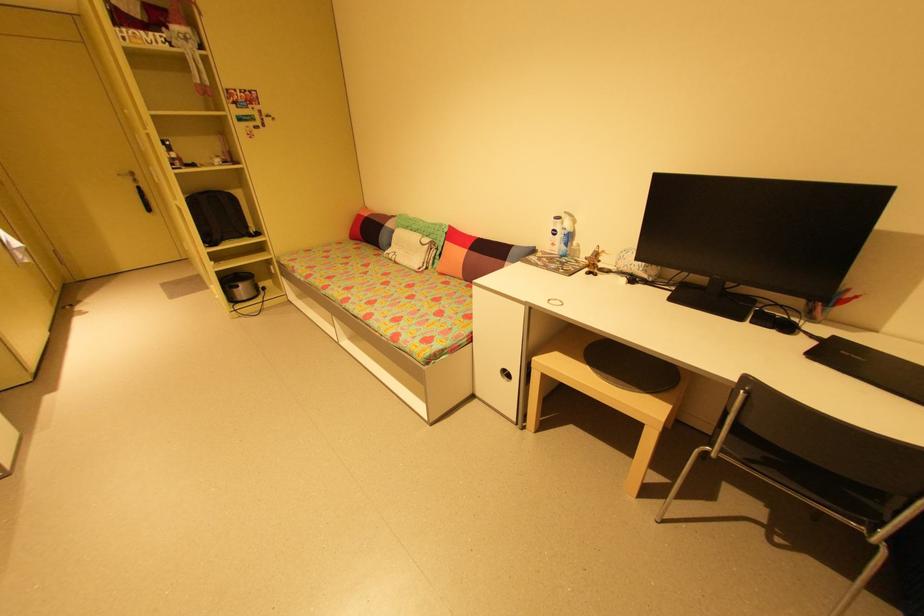
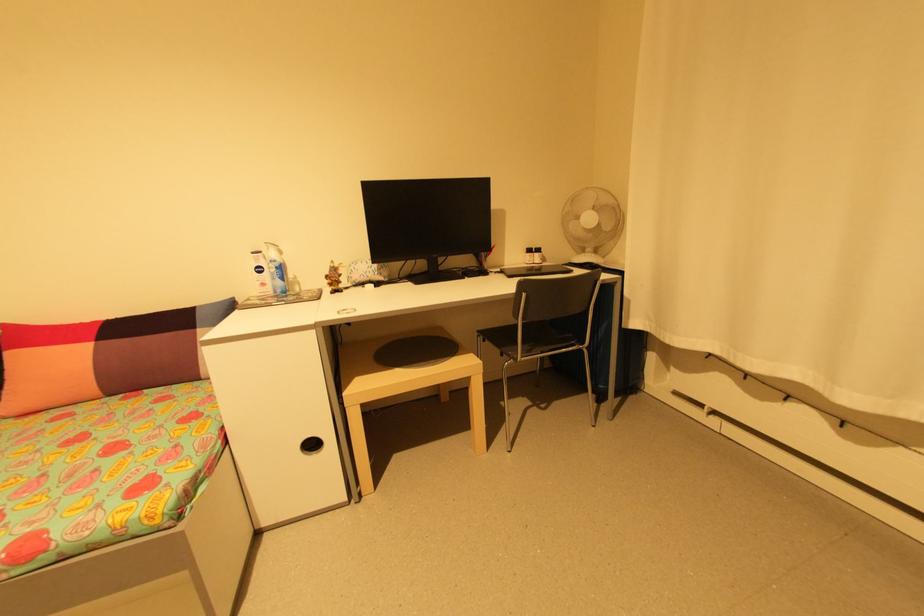
Find the pixel in the second image that matches (455,227) in the first image.

(8, 326)